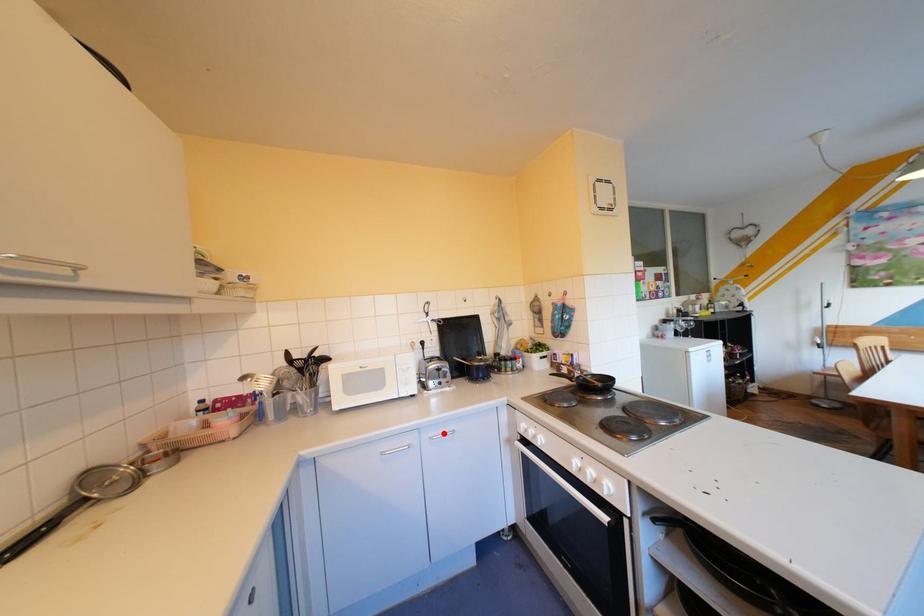
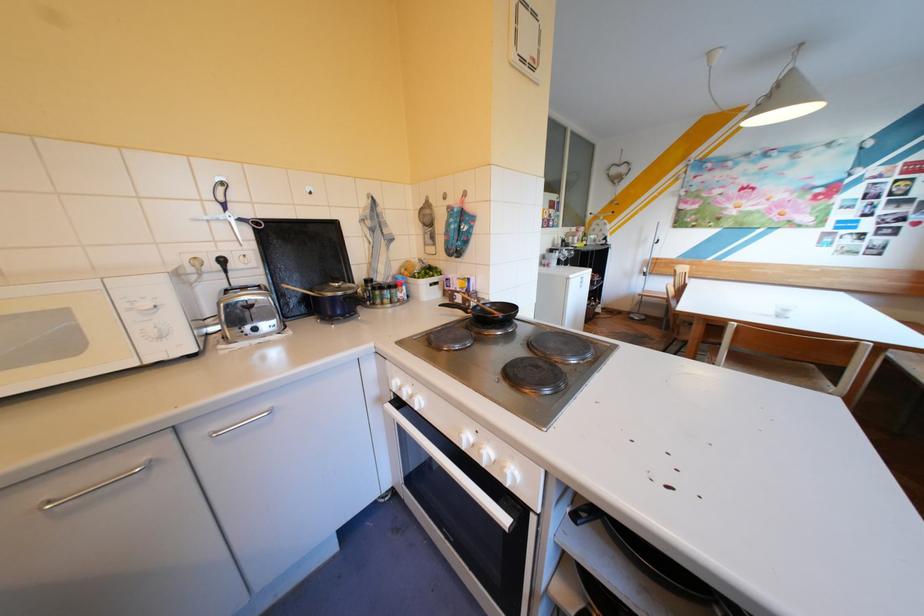
Question: I am providing you with two images of the same scene from different viewpoints. In image1, a red point is highlighted. Considering the same 3D point in image2, which of the following is correct?

Choices:
 (A) It is closer
 (B) It is farther

Answer: (A)